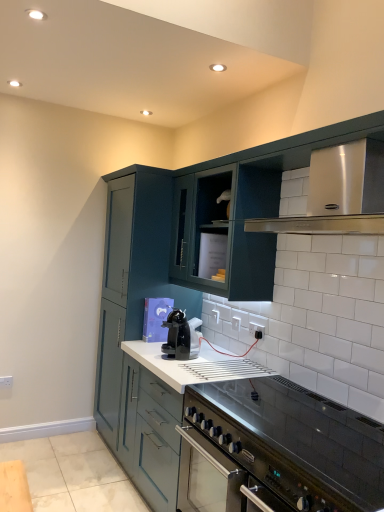
Find the location of a particular element. The image size is (384, 512). vacant position to the left of black glossy coffee machine at center is located at coordinates (155, 353).